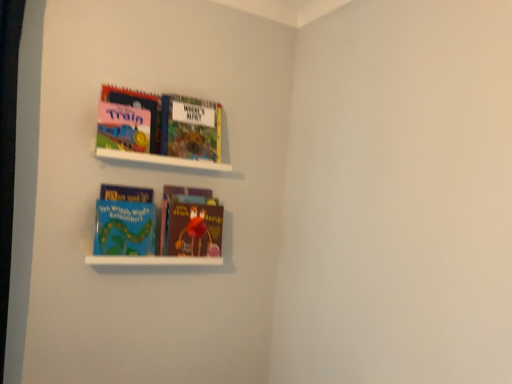
Where is `vacant area situated below brown matte book at center, acting as the 4th book starting from the top (from a real-world perspective)`? The image size is (512, 384). vacant area situated below brown matte book at center, acting as the 4th book starting from the top (from a real-world perspective) is located at coordinates (185, 251).